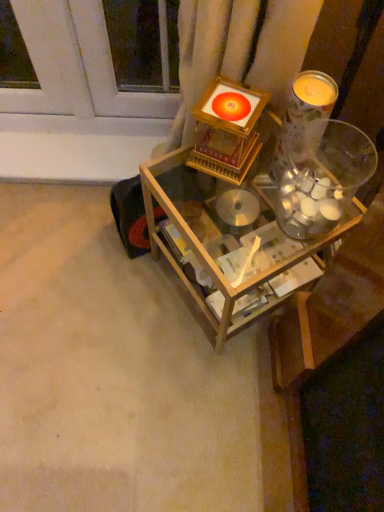
Where is `blank space to the left of translucent glass candle at upper right`? blank space to the left of translucent glass candle at upper right is located at coordinates (200, 198).